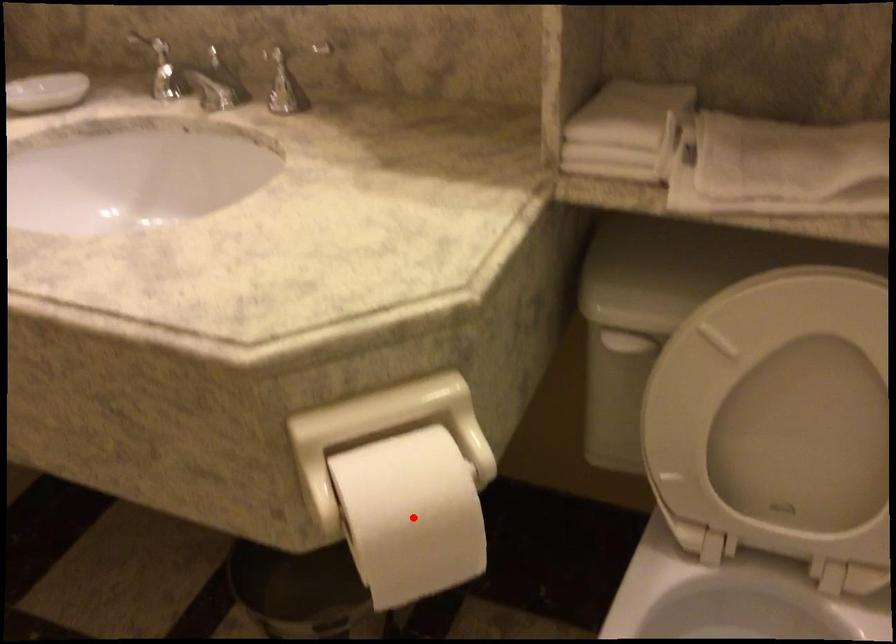
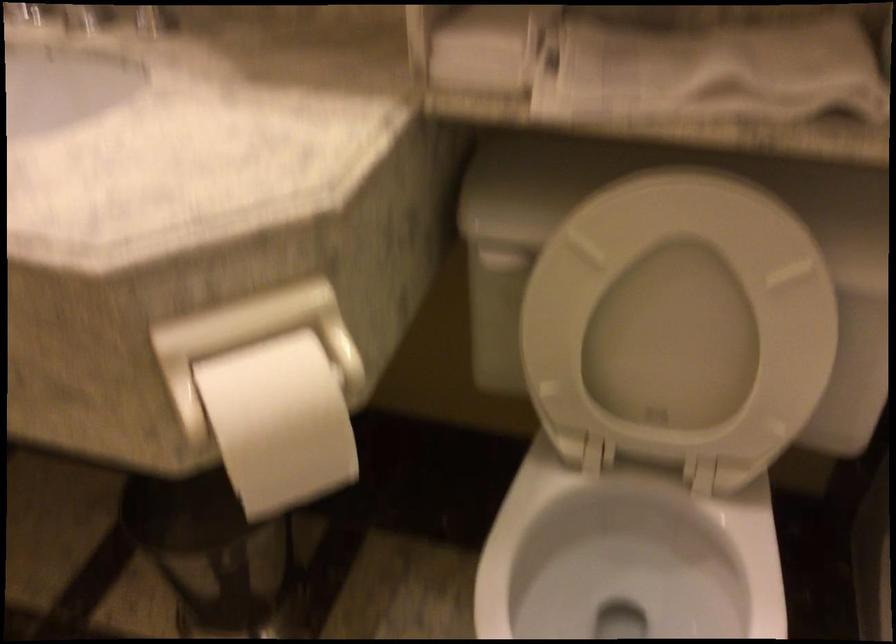
In the second image, find the point that corresponds to the highlighted location in the first image.

(279, 422)